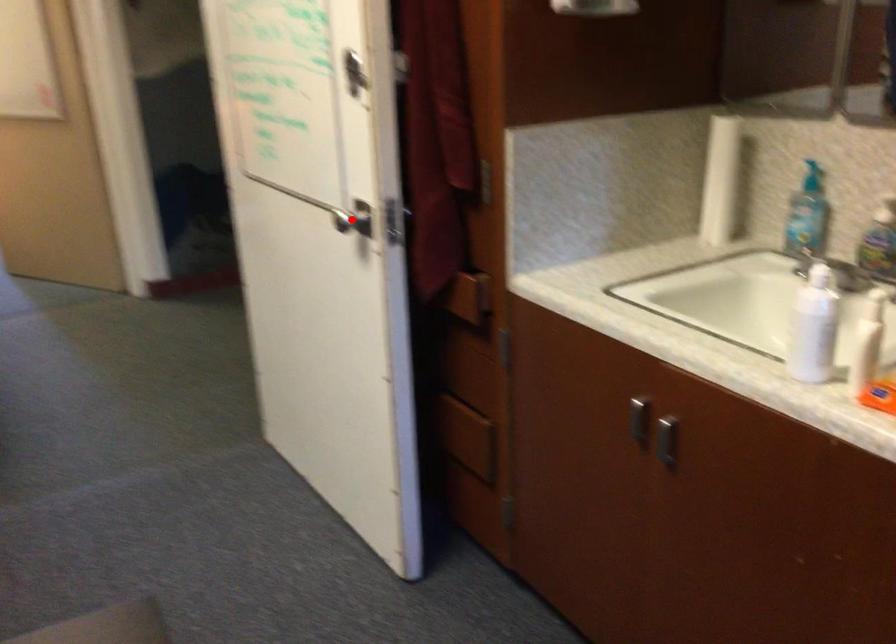
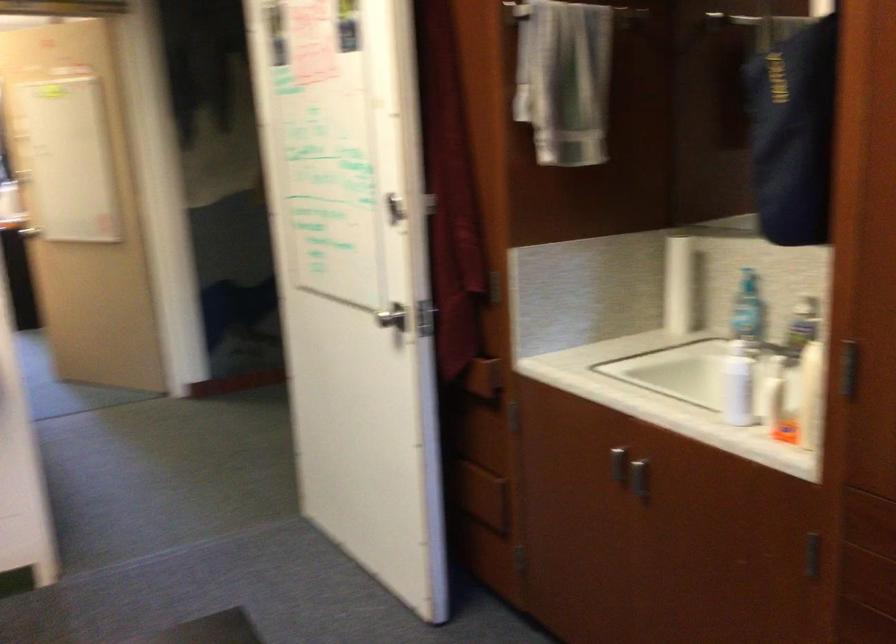
Question: I am providing you with two images of the same scene from different viewpoints. A red point is marked on the first image. At the location where the point appears in image 1, is it still visible in image 2?

Choices:
 (A) Yes
 (B) No

Answer: (A)